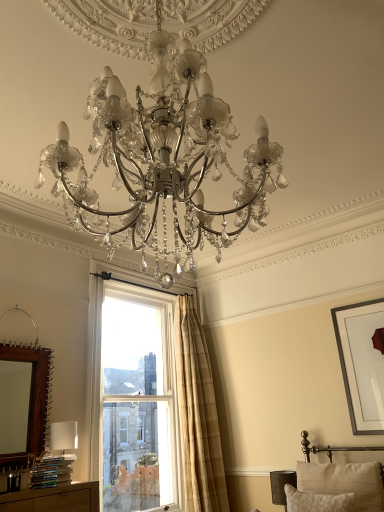
Question: Is beige textured pillow at lower right, which appears as the 1th pillow when viewed from the front, next to brown wooden mirror at left and touching it?

Choices:
 (A) no
 (B) yes

Answer: (A)

Question: Would you say brown wooden mirror at left is part of beige textured pillow at lower right, positioned as the second pillow in back-to-front order,'s contents?

Choices:
 (A) no
 (B) yes

Answer: (A)

Question: Does beige textured pillow at lower right, positioned as the second pillow in back-to-front order, have a larger size compared to brown wooden mirror at left?

Choices:
 (A) no
 (B) yes

Answer: (A)

Question: Does beige textured pillow at lower right, positioned as the second pillow in back-to-front order, have a greater height compared to brown wooden mirror at left?

Choices:
 (A) yes
 (B) no

Answer: (B)

Question: Can you confirm if beige textured pillow at lower right, positioned as the second pillow in back-to-front order, is positioned to the right of brown wooden mirror at left?

Choices:
 (A) yes
 (B) no

Answer: (A)

Question: Is beige textured pillow at lower right, which appears as the 1th pillow when viewed from the front, wider than brown wooden mirror at left?

Choices:
 (A) yes
 (B) no

Answer: (A)

Question: Is beige textured pillow at lower right, the second pillow when ordered from front to back, to the right of matte silver chandelier at center from the viewer's perspective?

Choices:
 (A) yes
 (B) no

Answer: (A)

Question: Is beige textured pillow at lower right, the second pillow when ordered from front to back, not inside matte silver chandelier at center?

Choices:
 (A) no
 (B) yes

Answer: (B)

Question: Does beige textured pillow at lower right, which ranks as the 1th pillow in back-to-front order, have a greater height compared to matte silver chandelier at center?

Choices:
 (A) no
 (B) yes

Answer: (A)

Question: Does beige textured pillow at lower right, the second pillow when ordered from front to back, have a lesser width compared to matte silver chandelier at center?

Choices:
 (A) yes
 (B) no

Answer: (A)

Question: Is beige textured pillow at lower right, which ranks as the 1th pillow in back-to-front order, bigger than matte silver chandelier at center?

Choices:
 (A) no
 (B) yes

Answer: (A)

Question: From a real-world perspective, does beige textured pillow at lower right, which ranks as the 1th pillow in back-to-front order, sit lower than matte silver chandelier at center?

Choices:
 (A) yes
 (B) no

Answer: (A)

Question: Considering the relative sizes of beige plaid curtain at upper right and brown wooden mirror at left in the image provided, is beige plaid curtain at upper right shorter than brown wooden mirror at left?

Choices:
 (A) yes
 (B) no

Answer: (B)